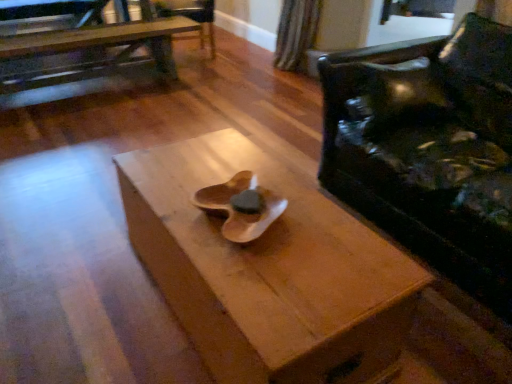
This screenshot has width=512, height=384. I want to click on vacant space to the left of wooden table at center, the 1th table viewed from the right, so click(83, 279).